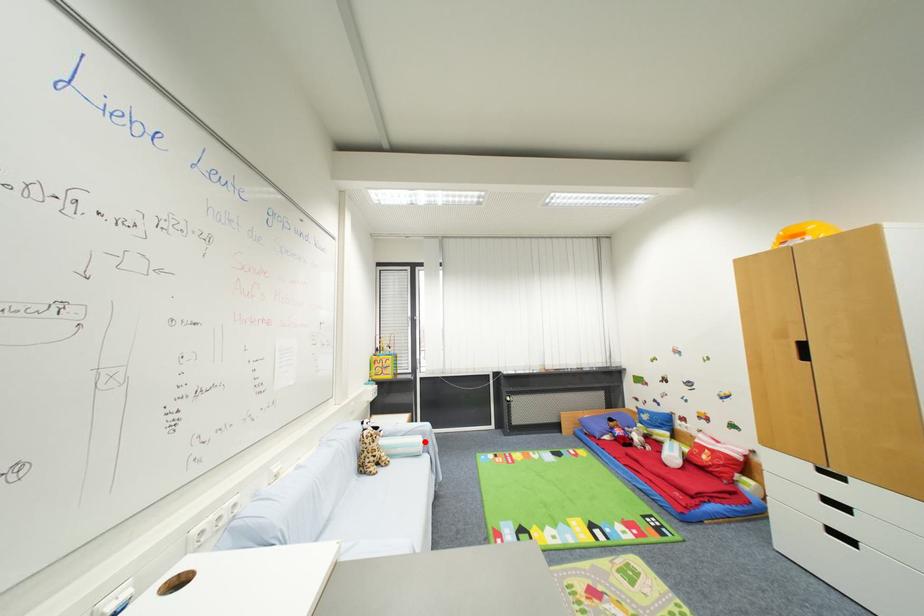
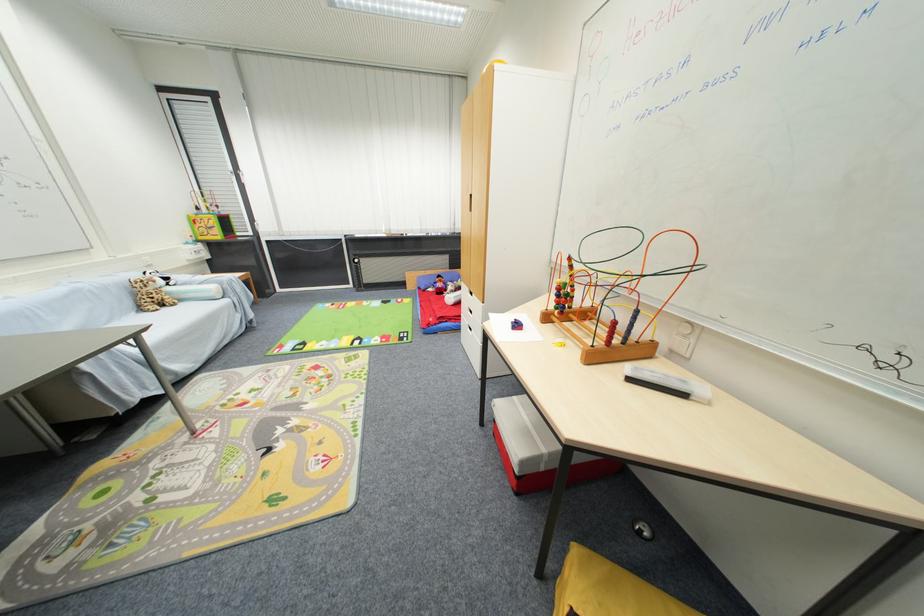
In the second image, find the point that corresponds to the highlighted location in the first image.

(217, 290)